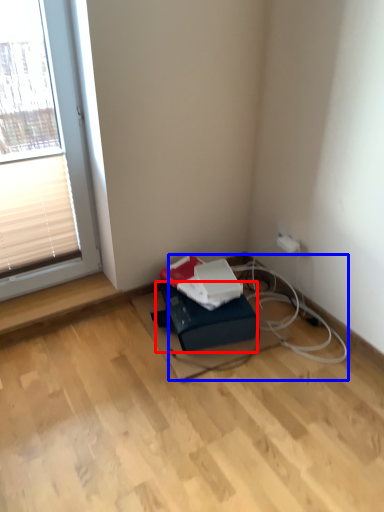
Question: Which point is further to the camera, cardboard box (highlighted by a red box) or cable (highlighted by a blue box)?

Choices:
 (A) cardboard box
 (B) cable

Answer: (A)